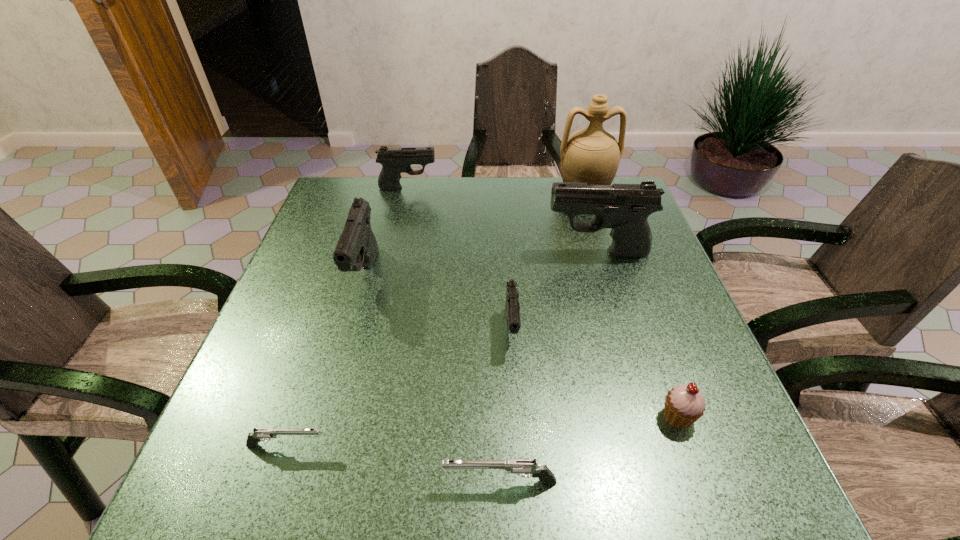
Find the location of `blank region between the fourth tallest pistol and the tallest object`. blank region between the fourth tallest pistol and the tallest object is located at coordinates (547, 261).

This screenshot has height=540, width=960. What are the coordinates of `free space between the bigger silver pistol and the fourth tallest object` in the screenshot? It's located at (454, 335).

Where is `empty space between the pitcher and the second biggest black pistol`? The image size is (960, 540). empty space between the pitcher and the second biggest black pistol is located at coordinates tap(474, 233).

Locate an element on the screen. free area in between the smallest black pistol and the third smallest black pistol is located at coordinates (439, 302).

Identify the location of vacant space that is in between the second black pistol from right to left and the pitcher. The height and width of the screenshot is (540, 960). (547, 261).

What are the coordinates of `vacant area between the left silver pistol and the second tallest object` in the screenshot? It's located at (442, 349).

The height and width of the screenshot is (540, 960). I want to click on empty space that is in between the second nearest pistol and the cupcake, so [x=482, y=431].

Identify which object is the fifth nearest to the nearer silver pistol. Please provide its 2D coordinates. Your answer should be formatted as a tuple, i.e. [(x, y)], where the tuple contains the x and y coordinates of a point satisfying the conditions above.

[(625, 208)]

Identify which object is the third nearest to the shortest object. Please provide its 2D coordinates. Your answer should be formatted as a tuple, i.e. [(x, y)], where the tuple contains the x and y coordinates of a point satisfying the conditions above.

[(512, 307)]

The image size is (960, 540). I want to click on pistol object that ranks as the fifth closest to the pitcher, so click(x=522, y=467).